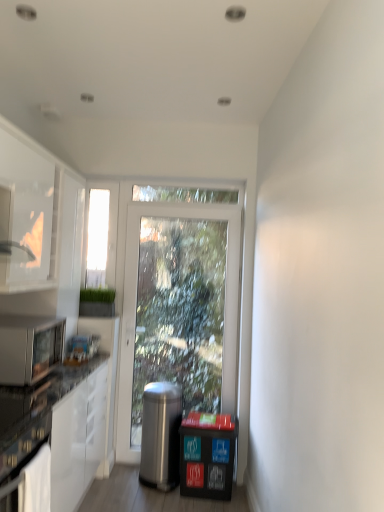
This screenshot has width=384, height=512. What do you see at coordinates (41, 215) in the screenshot?
I see `white glossy cabinet at left` at bounding box center [41, 215].

Where is `transparent glass window screen at left`? This screenshot has height=512, width=384. transparent glass window screen at left is located at coordinates (97, 238).

The height and width of the screenshot is (512, 384). I want to click on polished stainless steel trash can at center, so click(x=161, y=435).

Is transparent glass window screen at left at the back of black plastic recycling bin at lower right?

That's not correct — black plastic recycling bin at lower right is not looking away from transparent glass window screen at left.

Is black plastic recycling bin at lower right not near transparent glass window screen at left?

Yes, black plastic recycling bin at lower right and transparent glass window screen at left are quite far apart.

From the image's perspective, is black plastic recycling bin at lower right on transparent glass window screen at left?

No.

Which object is further away from the camera, black plastic recycling bin at lower right or transparent glass window screen at left?

Positioned behind is transparent glass window screen at left.

Is black plastic recycling bin at lower right oriented away from polished stainless steel trash can at center?

No, black plastic recycling bin at lower right is not facing the opposite direction of polished stainless steel trash can at center.

Is black plastic recycling bin at lower right next to polished stainless steel trash can at center?

No.

Does black plastic recycling bin at lower right lie behind polished stainless steel trash can at center?

No, black plastic recycling bin at lower right is in front of polished stainless steel trash can at center.

Is black plastic recycling bin at lower right to the left or to the right of polished stainless steel trash can at center in the image?

Clearly, black plastic recycling bin at lower right is on the right of polished stainless steel trash can at center in the image.

From the picture: Which is correct: polished stainless steel trash can at center is inside white glossy cabinet at left, or outside of it?

polished stainless steel trash can at center is located beyond the bounds of white glossy cabinet at left.

Looking at this image, from the image's perspective, which is above, polished stainless steel trash can at center or white glossy cabinet at left?

white glossy cabinet at left is shown above in the image.

Is point (156, 437) positioned behind point (29, 275)?

Yes, point (156, 437) is farther from viewer.

Is polished stainless steel trash can at center not close to white glossy cabinet at left?

Yes.

Are black plastic recycling bin at lower right and white glossy cabinet at left making contact?

They are not placed beside each other.

Is black plastic recycling bin at lower right thinner than white glossy cabinet at left?

No, black plastic recycling bin at lower right is not thinner than white glossy cabinet at left.

How much distance is there between black plastic recycling bin at lower right and white glossy cabinet at left?

black plastic recycling bin at lower right and white glossy cabinet at left are 1.55 meters apart from each other.

Is white glossy cabinet at left a part of black plastic recycling bin at lower right?

No, white glossy cabinet at left is not a part of black plastic recycling bin at lower right.

Consider the image. Is transparent glass window screen at left beside polished stainless steel trash can at center?

There is a gap between transparent glass window screen at left and polished stainless steel trash can at center.

Is transparent glass window screen at left wider than polished stainless steel trash can at center?

In fact, transparent glass window screen at left might be narrower than polished stainless steel trash can at center.

Is transparent glass window screen at left in front of polished stainless steel trash can at center?

That is False.

From a real-world perspective, is transparent glass window screen at left positioned above or below polished stainless steel trash can at center?

In terms of real-world spatial position, transparent glass window screen at left is above polished stainless steel trash can at center.

Is polished stainless steel trash can at center inside white glossy cabinet at left?

No, polished stainless steel trash can at center is not inside white glossy cabinet at left.

From a real-world perspective, is white glossy cabinet at left positioned under polished stainless steel trash can at center based on gravity?

Incorrect, from a real-world perspective, white glossy cabinet at left is higher than polished stainless steel trash can at center.

Does white glossy cabinet at left have a lesser height compared to polished stainless steel trash can at center?

Incorrect, the height of white glossy cabinet at left does not fall short of that of polished stainless steel trash can at center.

From the picture: Between white glossy cabinet at left and satin black microwave oven at lower left, which one is positioned behind?

Positioned behind is white glossy cabinet at left.

Is point (27, 288) closer or farther from the camera than point (11, 324)?

Point (27, 288) is positioned closer to the camera compared to point (11, 324).

Identify the location of microwave oven below the white glossy cabinet at left (from the image's perspective). This screenshot has width=384, height=512. (29, 348).

Find the location of `window screen above the black plastic recycling bin at lower right (from the image's perspective)`. window screen above the black plastic recycling bin at lower right (from the image's perspective) is located at coordinates (97, 238).

You are a GUI agent. You are given a task and a screenshot of the screen. Output one action in this format:
    pyautogui.click(x=<x>, y=<y>)
    Task: Click on the appliance behind the black plastic recycling bin at lower right
    The width and height of the screenshot is (384, 512).
    Given the screenshot: What is the action you would take?
    pyautogui.click(x=161, y=435)

Which object lies nearer to the anchor point transparent glass window screen at left, polished stainless steel trash can at center or satin black microwave oven at lower left?

Based on the image, satin black microwave oven at lower left appears to be nearer to transparent glass window screen at left.

Looking at the image, which one is located further to black plastic recycling bin at lower right, transparent glass window screen at left or polished stainless steel trash can at center?

transparent glass window screen at left is further to black plastic recycling bin at lower right.

Considering their positions, is polished stainless steel trash can at center positioned closer to white glossy cabinet at left than transparent glass window screen at left?

transparent glass window screen at left is positioned closer to the anchor white glossy cabinet at left.

Looking at the image, which one is located closer to white glossy cabinet at left, polished stainless steel trash can at center or satin black microwave oven at lower left?

Among the two, satin black microwave oven at lower left is located nearer to white glossy cabinet at left.

Which object lies nearer to the anchor point black plastic recycling bin at lower right, white glossy cabinet at left or transparent glass window screen at left?

transparent glass window screen at left.

From the image, which object appears to be nearer to satin black microwave oven at lower left, polished stainless steel trash can at center or white glossy cabinet at left?

The object closer to satin black microwave oven at lower left is white glossy cabinet at left.

In the scene shown: Considering their positions, is polished stainless steel trash can at center positioned further to satin black microwave oven at lower left than black plastic recycling bin at lower right?

Among the two, black plastic recycling bin at lower right is located further to satin black microwave oven at lower left.

Based on their spatial positions, is polished stainless steel trash can at center or satin black microwave oven at lower left further from black plastic recycling bin at lower right?

satin black microwave oven at lower left is further to black plastic recycling bin at lower right.

Where is `microwave oven between white glossy cabinet at left and polished stainless steel trash can at center from top to bottom`? microwave oven between white glossy cabinet at left and polished stainless steel trash can at center from top to bottom is located at coordinates (29, 348).

Locate an element on the screen. cabinetry between transparent glass window screen at left and black plastic recycling bin at lower right vertically is located at coordinates (41, 215).

Locate an element on the screen. This screenshot has height=512, width=384. cabinetry between satin black microwave oven at lower left and transparent glass window screen at left from front to back is located at coordinates (41, 215).

Find the location of `microwave oven between transparent glass window screen at left and black plastic recycling bin at lower right from top to bottom`. microwave oven between transparent glass window screen at left and black plastic recycling bin at lower right from top to bottom is located at coordinates (29, 348).